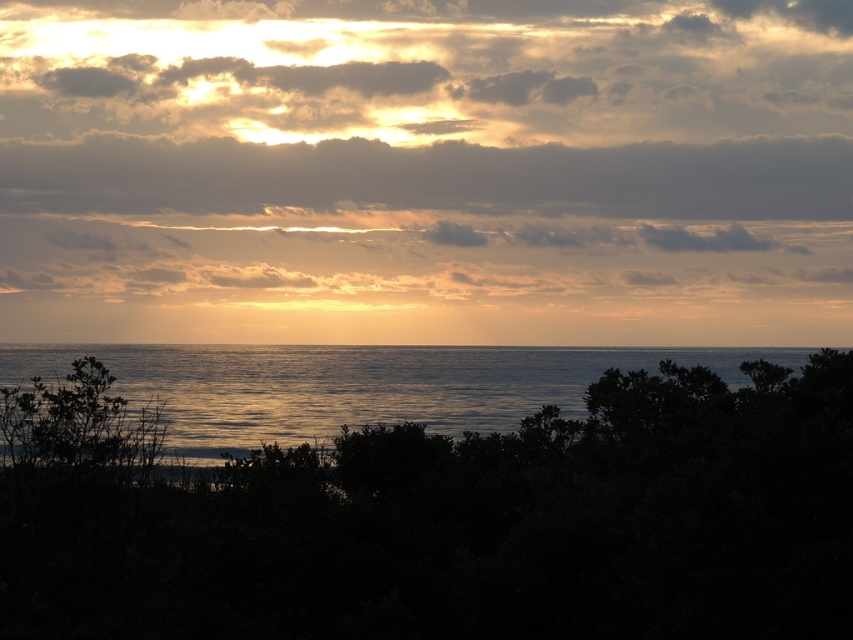
Can you confirm if cloudy sky at upper center is positioned below glistening water at center?

Actually, cloudy sky at upper center is above glistening water at center.

Where is `cloudy sky at upper center`? The height and width of the screenshot is (640, 853). cloudy sky at upper center is located at coordinates (426, 172).

This screenshot has width=853, height=640. In order to click on cloudy sky at upper center in this screenshot , I will do `click(426, 172)`.

Does green leafy tree at center appear over glistening water at center?

Yes.

Between point (364, 632) and point (125, 356), which one is positioned behind?

The point (125, 356) is behind.

Is point (390, 529) positioned behind point (149, 372)?

No, it is in front of (149, 372).

Where is `green leafy tree at center`? green leafy tree at center is located at coordinates (450, 520).

Can you confirm if dark gray cloud at upper center is positioned above glistening water at center?

Indeed, dark gray cloud at upper center is positioned over glistening water at center.

Which is behind, point (149, 157) or point (384, 397)?

Positioned behind is point (149, 157).

Image resolution: width=853 pixels, height=640 pixels. What are the coordinates of `dark gray cloud at upper center` in the screenshot? It's located at (430, 179).